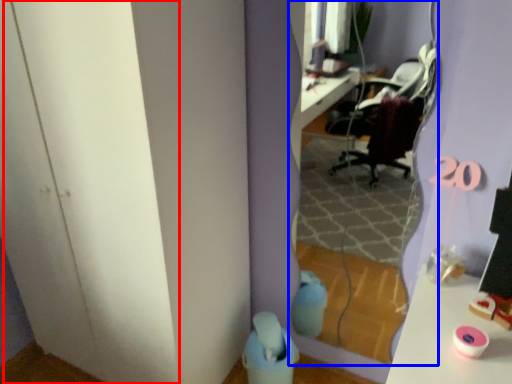
Question: Among these objects, which one is farthest to the camera, glass door (highlighted by a red box) or mirror (highlighted by a blue box)?

Choices:
 (A) glass door
 (B) mirror

Answer: (B)